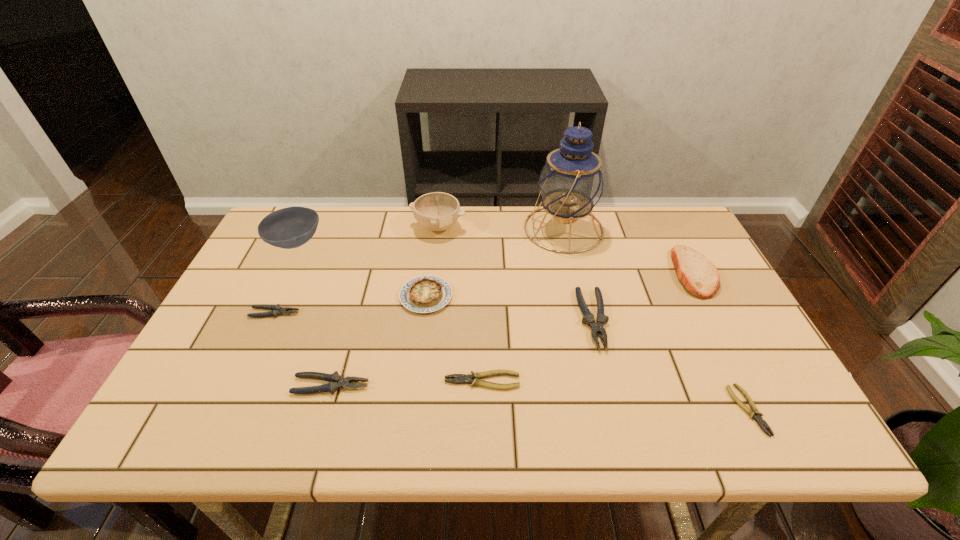
Image resolution: width=960 pixels, height=540 pixels. What are the coordinates of `free space between the second pliers from right to left and the beige bowl` in the screenshot? It's located at (516, 273).

The height and width of the screenshot is (540, 960). I want to click on free spot between the tallest object and the right bowl, so click(x=501, y=228).

Locate an element on the screen. vacant area that lies between the quiche and the blue lantern is located at coordinates (494, 262).

Select which object appears as the fifth closest to the left yellow pliers. Please provide its 2D coordinates. Your answer should be formatted as a tuple, i.e. [(x, y)], where the tuple contains the x and y coordinates of a point satisfying the conditions above.

[(277, 310)]

Identify which object is the fourth nearest to the brown bowl. Please provide its 2D coordinates. Your answer should be formatted as a tuple, i.e. [(x, y)], where the tuple contains the x and y coordinates of a point satisfying the conditions above.

[(336, 382)]

Identify which pliers is located as the fifth nearest to the quiche. Please provide its 2D coordinates. Your answer should be formatted as a tuple, i.e. [(x, y)], where the tuple contains the x and y coordinates of a point satisfying the conditions above.

[(754, 413)]

Locate which pliers ranks in proximity to the tallest pliers. Please provide its 2D coordinates. Your answer should be formatted as a tuple, i.e. [(x, y)], where the tuple contains the x and y coordinates of a point satisfying the conditions above.

[(474, 378)]

The height and width of the screenshot is (540, 960). Find the location of `gray pliers that is the second closest to the smallest gray pliers`. gray pliers that is the second closest to the smallest gray pliers is located at coordinates (596, 327).

Select which gray pliers appears as the closest to the quiche. Please provide its 2D coordinates. Your answer should be formatted as a tuple, i.e. [(x, y)], where the tuple contains the x and y coordinates of a point satisfying the conditions above.

[(336, 382)]

Where is `blank space that satisfies the following two spatial constraints: 1. on the front-facing side of the lantern; 2. on the right side of the fourth tallest object`? This screenshot has width=960, height=540. blank space that satisfies the following two spatial constraints: 1. on the front-facing side of the lantern; 2. on the right side of the fourth tallest object is located at coordinates pos(574,273).